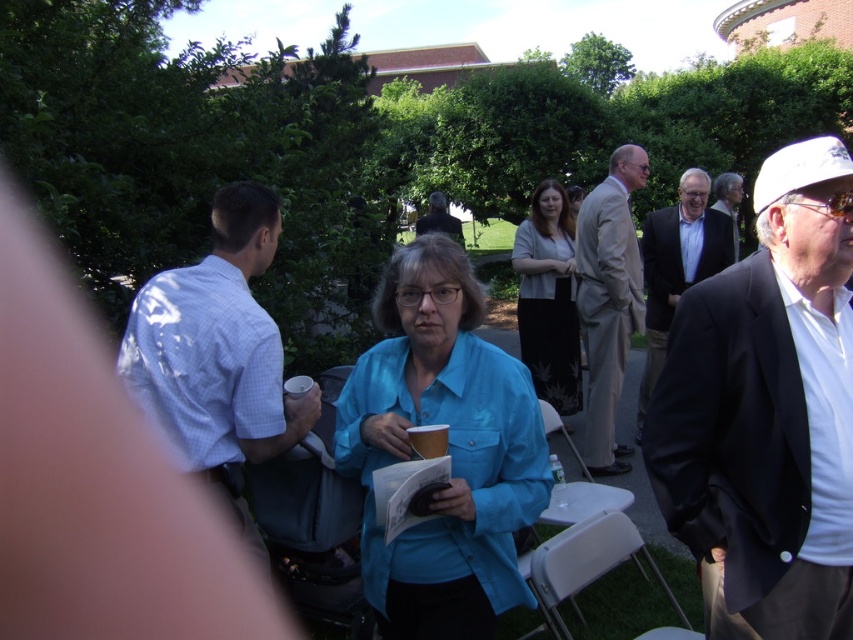
Question: Does light brown suit at center appear under white paper cup at center?

Choices:
 (A) yes
 (B) no

Answer: (B)

Question: Which point is closer to the camera?

Choices:
 (A) (306, 384)
 (B) (590, 321)
 (C) (416, 557)

Answer: (C)

Question: Is light beige suit at upper right bigger than white cotton shirt at right?

Choices:
 (A) yes
 (B) no

Answer: (A)

Question: Estimate the real-world distances between objects in this image. Which object is farther from the white paper cup at center?

Choices:
 (A) clear plastic bottle at center
 (B) matte plastic cup at center
 (C) light blue shirt at center
 (D) light brown suit at center

Answer: (D)

Question: Is light brown suit at center positioned in front of dark gray suit at center?

Choices:
 (A) yes
 (B) no

Answer: (A)

Question: Which of the following is the farthest from the observer?

Choices:
 (A) (625, 314)
 (B) (375, 314)
 (C) (553, 460)
 (D) (425, 454)

Answer: (A)